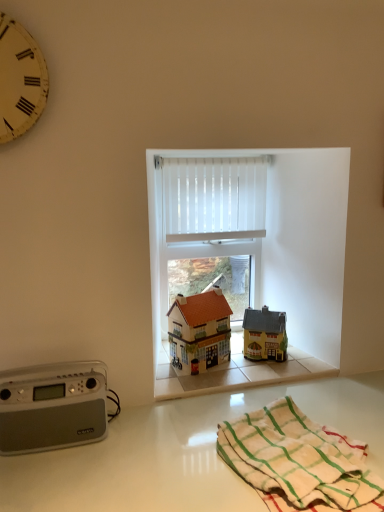
Question: From the image's perspective, would you say white glossy countertop at lower center is positioned over matte orange roofed house at center, the first toy in the left-to-right sequence?

Choices:
 (A) yes
 (B) no

Answer: (B)

Question: Is white glossy countertop at lower center thinner than matte orange roofed house at center, the 2th toy in the right-to-left sequence?

Choices:
 (A) yes
 (B) no

Answer: (B)

Question: From a real-world perspective, is white glossy countertop at lower center on matte orange roofed house at center, the first toy in the left-to-right sequence?

Choices:
 (A) yes
 (B) no

Answer: (B)

Question: Considering the relative sizes of white glossy countertop at lower center and matte orange roofed house at center, the first toy in the left-to-right sequence, in the image provided, is white glossy countertop at lower center wider than matte orange roofed house at center, the first toy in the left-to-right sequence,?

Choices:
 (A) no
 (B) yes

Answer: (B)

Question: Is white glossy countertop at lower center outside matte orange roofed house at center, the 2th toy in the right-to-left sequence?

Choices:
 (A) yes
 (B) no

Answer: (A)

Question: Is white cotton towel at lower right bigger or smaller than yellow matte house at center, the first toy viewed from the right?

Choices:
 (A) small
 (B) big

Answer: (B)

Question: Is white cotton towel at lower right inside or outside of yellow matte house at center, the second toy in the left-to-right sequence?

Choices:
 (A) outside
 (B) inside

Answer: (A)

Question: From a real-world perspective, is white cotton towel at lower right above or below yellow matte house at center, the second toy in the left-to-right sequence?

Choices:
 (A) above
 (B) below

Answer: (B)

Question: In the image, is white cotton towel at lower right positioned in front of or behind yellow matte house at center, the first toy viewed from the right?

Choices:
 (A) behind
 (B) front

Answer: (B)

Question: Is yellow painted wood clock at upper left taller or shorter than matte orange roofed house at center, the first toy in the left-to-right sequence?

Choices:
 (A) short
 (B) tall

Answer: (B)

Question: Choose the correct answer: Is yellow painted wood clock at upper left inside matte orange roofed house at center, the 2th toy in the right-to-left sequence, or outside it?

Choices:
 (A) inside
 (B) outside

Answer: (B)

Question: Considering the positions of point (29, 77) and point (190, 347), is point (29, 77) closer or farther from the camera than point (190, 347)?

Choices:
 (A) closer
 (B) farther

Answer: (A)

Question: In terms of width, does yellow painted wood clock at upper left look wider or thinner when compared to matte orange roofed house at center, the 2th toy in the right-to-left sequence?

Choices:
 (A) thin
 (B) wide

Answer: (A)

Question: From a real-world perspective, is white vertical blinds at center above or below white cotton towel at lower right?

Choices:
 (A) above
 (B) below

Answer: (A)

Question: Considering the positions of white vertical blinds at center and white cotton towel at lower right in the image, is white vertical blinds at center bigger or smaller than white cotton towel at lower right?

Choices:
 (A) big
 (B) small

Answer: (B)